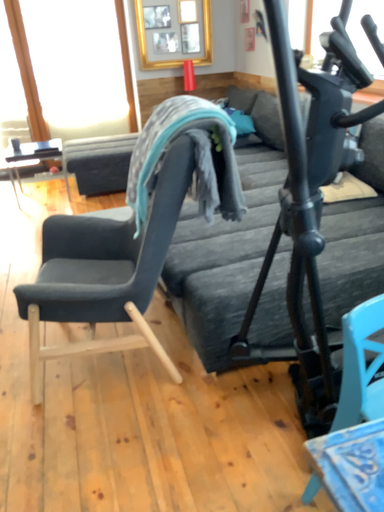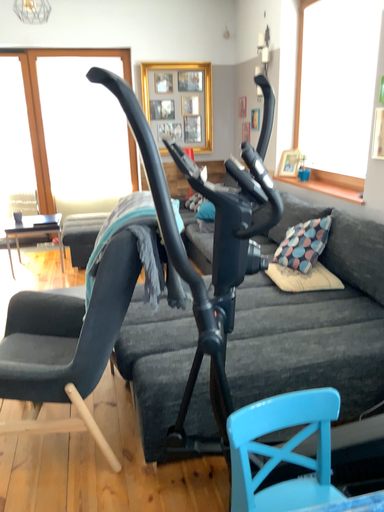
Question: How did the camera likely rotate when shooting the video?

Choices:
 (A) rotated upward
 (B) rotated downward

Answer: (A)